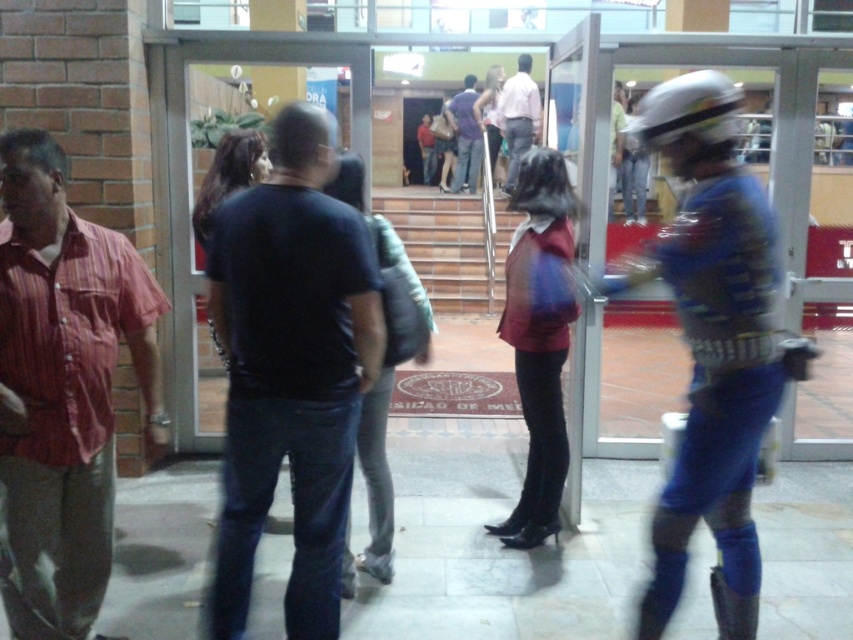
Who is positioned more to the right, dark blue shirt at center or transparent glass door at center?

From the viewer's perspective, dark blue shirt at center appears more on the right side.

Between dark blue shirt at center and transparent glass door at center, which one has less height?

Standing shorter between the two is dark blue shirt at center.

Find the location of a particular element. dark blue shirt at center is located at coordinates (289, 369).

Who is more forward, (236, 58) or (502, 134)?

Point (236, 58) is in front.

Based on the photo, between transparent glass door at center and matte pink shirt at center, which one has less height?

Standing shorter between the two is matte pink shirt at center.

Where is `transparent glass door at center`? The image size is (853, 640). transparent glass door at center is located at coordinates (189, 182).

Can you confirm if dark blue shirt at center is smaller than blue metallic armor at center?

Yes.

Is dark blue shirt at center positioned at the back of blue metallic armor at center?

Yes, it is behind blue metallic armor at center.

Find the location of a particular element. The image size is (853, 640). dark blue shirt at center is located at coordinates (289, 369).